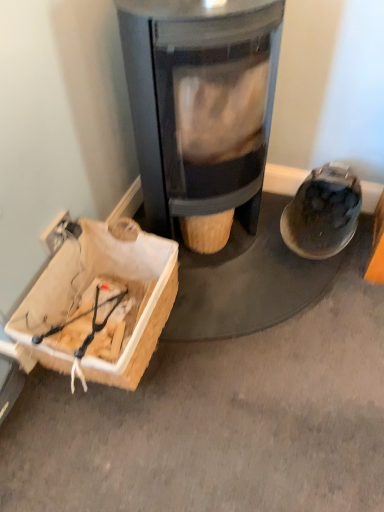
The width and height of the screenshot is (384, 512). What do you see at coordinates (210, 91) in the screenshot?
I see `matte black wood burning stove at center` at bounding box center [210, 91].

This screenshot has height=512, width=384. What do you see at coordinates (101, 303) in the screenshot?
I see `wooden crate at lower left` at bounding box center [101, 303].

This screenshot has height=512, width=384. What are the coordinates of `matte black wood burning stove at center` in the screenshot? It's located at (210, 91).

Could you tell me if matte black shoe at right is facing matte black wood burning stove at center?

No, matte black shoe at right is not turned towards matte black wood burning stove at center.

Looking at this image, from a real-world perspective, is matte black shoe at right positioned under matte black wood burning stove at center based on gravity?

Yes, from a real-world perspective, matte black shoe at right is beneath matte black wood burning stove at center.

Measure the distance between matte black shoe at right and matte black wood burning stove at center.

matte black shoe at right and matte black wood burning stove at center are 46.46 centimeters apart from each other.

In terms of width, does matte black wood burning stove at center look wider or thinner when compared to wooden crate at lower left?

matte black wood burning stove at center is wider than wooden crate at lower left.

From the picture: Which object is positioned more to the left, matte black wood burning stove at center or wooden crate at lower left?

wooden crate at lower left.

Considering the positions of objects matte black wood burning stove at center and wooden crate at lower left in the image provided, who is behind, matte black wood burning stove at center or wooden crate at lower left?

Positioned behind is wooden crate at lower left.

Locate an element on the screen. wood burning stove lying above the wooden crate at lower left (from the image's perspective) is located at coordinates (210, 91).

Considering the sizes of objects matte black shoe at right and wooden crate at lower left in the image provided, who is shorter, matte black shoe at right or wooden crate at lower left?

wooden crate at lower left is shorter.

Would you say matte black shoe at right is to the left or to the right of wooden crate at lower left in the picture?

In the image, matte black shoe at right appears on the right side of wooden crate at lower left.

Which object is more forward, matte black shoe at right or wooden crate at lower left?

wooden crate at lower left.

In order to click on footwear on the right of wooden crate at lower left in this screenshot , I will do `click(322, 213)`.

Is the depth of wooden crate at lower left less than that of matte black shoe at right?

Yes, the depth of wooden crate at lower left is less than that of matte black shoe at right.

Is wooden crate at lower left shorter than matte black shoe at right?

Yes.

In the scene shown: Is matte black shoe at right a part of wooden crate at lower left?

No, matte black shoe at right is not a part of wooden crate at lower left.

Which object is positioned more to the right, matte black wood burning stove at center or matte black shoe at right?

matte black shoe at right.

Who is more distant, matte black wood burning stove at center or matte black shoe at right?

matte black shoe at right is more distant.

Considering the sizes of matte black wood burning stove at center and matte black shoe at right in the image, is matte black wood burning stove at center taller or shorter than matte black shoe at right?

Clearly, matte black wood burning stove at center is taller compared to matte black shoe at right.

The image size is (384, 512). I want to click on cardboard box located underneath the matte black wood burning stove at center (from a real-world perspective), so click(x=101, y=303).

Consider the image. Is matte black wood burning stove at center at the back of wooden crate at lower left?

No, matte black wood burning stove at center is not at the back of wooden crate at lower left.

From a real-world perspective, is wooden crate at lower left over matte black wood burning stove at center?

No, from a real-world perspective, wooden crate at lower left is not on top of matte black wood burning stove at center.

Does point (94, 378) appear closer or farther from the camera than point (149, 136)?

Point (94, 378) appears to be closer to the viewer than point (149, 136).

Locate an element on the screen. wood burning stove above the matte black shoe at right (from a real-world perspective) is located at coordinates (210, 91).

This screenshot has width=384, height=512. Find the location of `cardboard box behind the matte black wood burning stove at center`. cardboard box behind the matte black wood burning stove at center is located at coordinates pyautogui.click(x=101, y=303).

From the image, which object appears to be farther from matte black wood burning stove at center, wooden crate at lower left or matte black shoe at right?

The object further to matte black wood burning stove at center is matte black shoe at right.

Which object lies further to the anchor point wooden crate at lower left, matte black shoe at right or matte black wood burning stove at center?

matte black shoe at right is positioned further to the anchor wooden crate at lower left.

Based on their spatial positions, is matte black wood burning stove at center or matte black shoe at right further from wooden crate at lower left?

The object further to wooden crate at lower left is matte black shoe at right.

In the scene shown: Looking at the image, which one is located further to matte black shoe at right, matte black wood burning stove at center or wooden crate at lower left?

wooden crate at lower left.

Estimate the real-world distances between objects in this image. Which object is further from matte black wood burning stove at center, matte black shoe at right or wooden crate at lower left?

matte black shoe at right is positioned further to the anchor matte black wood burning stove at center.

Considering their positions, is wooden crate at lower left positioned closer to matte black shoe at right than matte black wood burning stove at center?

Among the two, matte black wood burning stove at center is located nearer to matte black shoe at right.

The width and height of the screenshot is (384, 512). Identify the location of wood burning stove located between wooden crate at lower left and matte black shoe at right in the left-right direction. (210, 91).